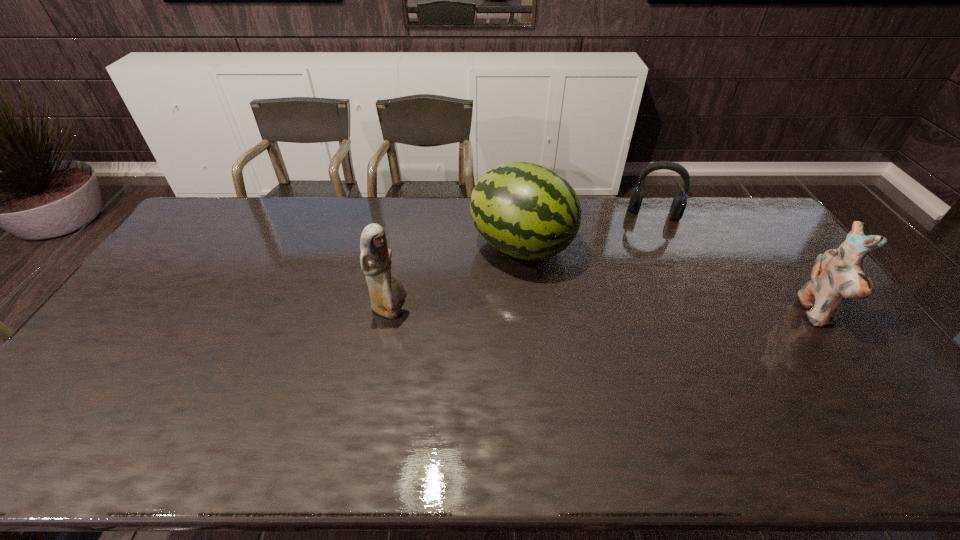
This screenshot has height=540, width=960. I want to click on vacant space on the desktop that is between the leftmost object and the right figurine and is positioned on the headband of the shortest object, so point(644,312).

In order to click on vacant space on the desktop that is between the leftmost object and the rightmost object and is positioned at the stem end of the watermelon in this screenshot , I will do `click(666, 313)`.